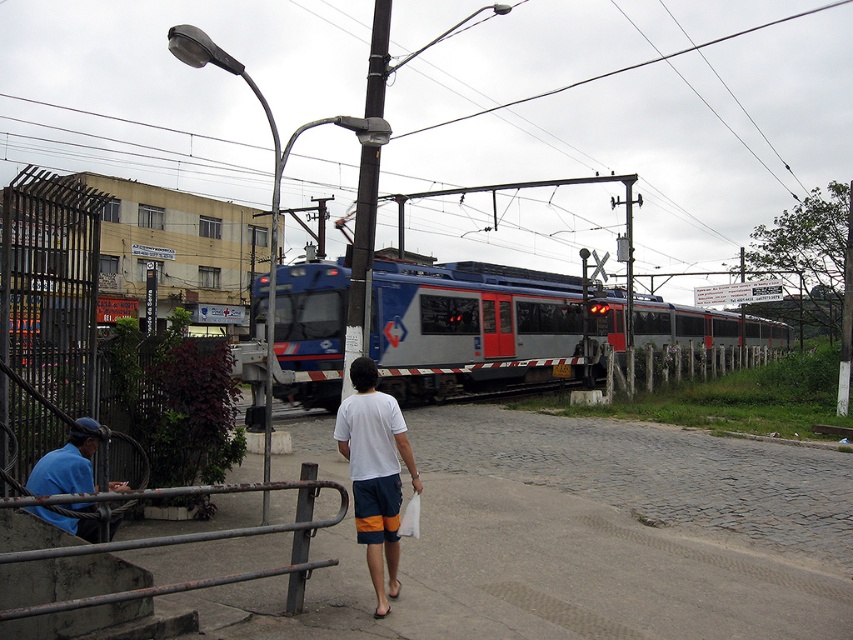
Question: Can you confirm if white cotton t-shirt at center is positioned to the right of blue fabric shirt at lower left?

Choices:
 (A) no
 (B) yes

Answer: (B)

Question: Which object is positioned farthest from the rusty metal rail at lower left?

Choices:
 (A) blue fabric shirt at lower left
 (B) brown wooden pole at center

Answer: (B)

Question: Which object appears closest to the camera in this image?

Choices:
 (A) blue metallic train at center
 (B) rusty metal rail at lower left

Answer: (B)

Question: Does brown wooden pole at center have a smaller size compared to blue fabric shirt at lower left?

Choices:
 (A) yes
 (B) no

Answer: (B)

Question: Which point is closer to the camera?

Choices:
 (A) [392, 580]
 (B) [370, 65]
 (C) [387, 275]

Answer: (A)

Question: Does rusty metal rail at lower left appear under brown wooden pole at center?

Choices:
 (A) yes
 (B) no

Answer: (A)